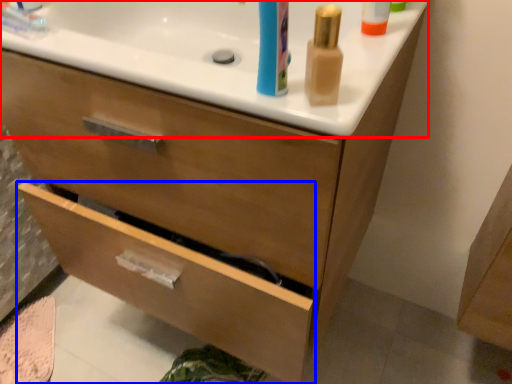
Question: Among these objects, which one is farthest to the camera, counter top (highlighted by a red box) or drawer (highlighted by a blue box)?

Choices:
 (A) counter top
 (B) drawer

Answer: (B)